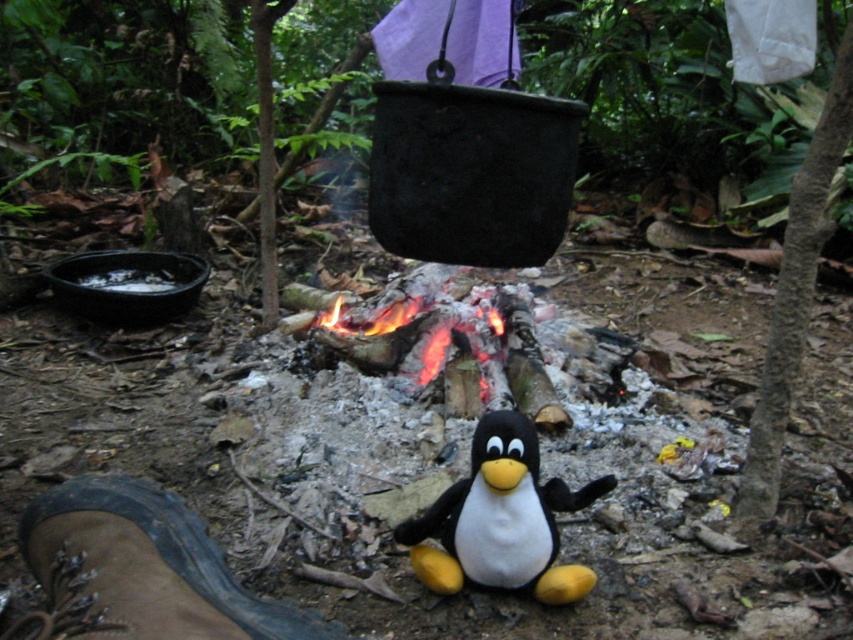
You are a hiker who just arrived at the campsite and want to place your brown leather boot at lower left near the fire without getting too close to the black plush penguin at center. Can you safely place your boot within 16 inches of the penguin?

The distance between the black plush penguin at center and the brown leather boot at lower left is 16.06 inches, so placing your boot within 16 inches would mean it is just slightly farther than the current distance, which is safe. However, since the exact required distance is 16 inches, the current placement is already at that measurement, so you can place it there safely.

You are a hiker who wants to place a small backpack between the black plush penguin at center and the brown leather boot at lower left. Based on their sizes, will the backpack fit between them?

The black plush penguin at center has a lesser width compared to brown leather boot at lower left, so the backpack should fit between them since there is enough space.